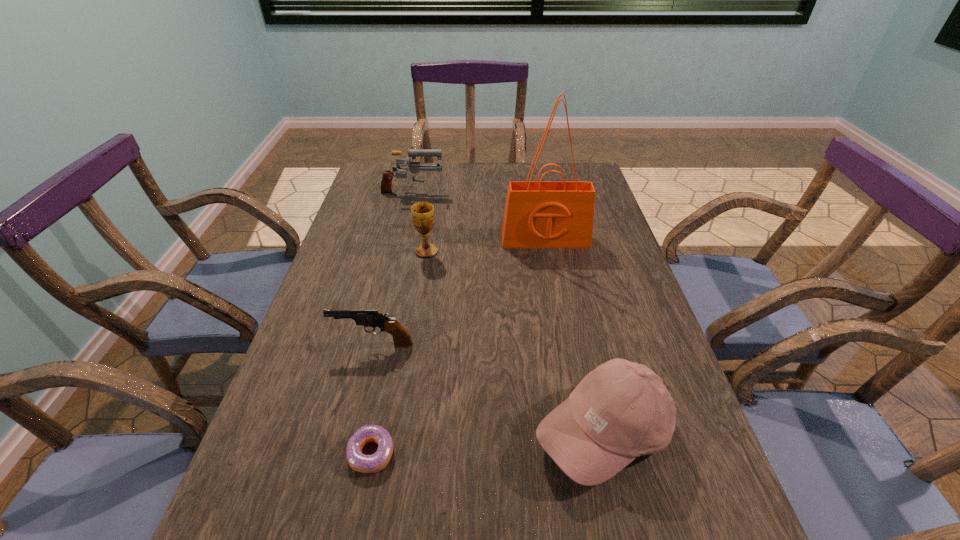
Identify the location of the tallest object. (538, 214).

The height and width of the screenshot is (540, 960). What are the coordinates of `the farther gun` in the screenshot? It's located at (414, 167).

Where is `the taller gun`? the taller gun is located at coordinates tap(414, 167).

This screenshot has height=540, width=960. Find the location of `chalice`. chalice is located at coordinates (422, 212).

The height and width of the screenshot is (540, 960). In order to click on baseball cap in this screenshot , I will do `click(621, 410)`.

The height and width of the screenshot is (540, 960). Find the location of `the second shortest object`. the second shortest object is located at coordinates (368, 318).

Locate an element on the screen. This screenshot has width=960, height=540. the shorter gun is located at coordinates (368, 318).

Find the location of a particular element. This screenshot has width=960, height=540. doughnut is located at coordinates (358, 461).

This screenshot has height=540, width=960. Find the location of `vacant space located 0.110m on the logo side of the tote bag`. vacant space located 0.110m on the logo side of the tote bag is located at coordinates (552, 274).

Identify the location of free space located 0.150m at the barrel end of the farthest object. The height and width of the screenshot is (540, 960). (489, 194).